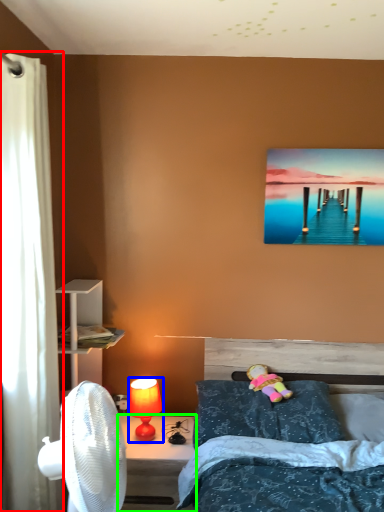
Question: Estimate the real-world distances between objects in this image. Which object is closer to curtain (highlighted by a red box), lamp (highlighted by a blue box) or desk (highlighted by a green box)?

Choices:
 (A) lamp
 (B) desk

Answer: (B)